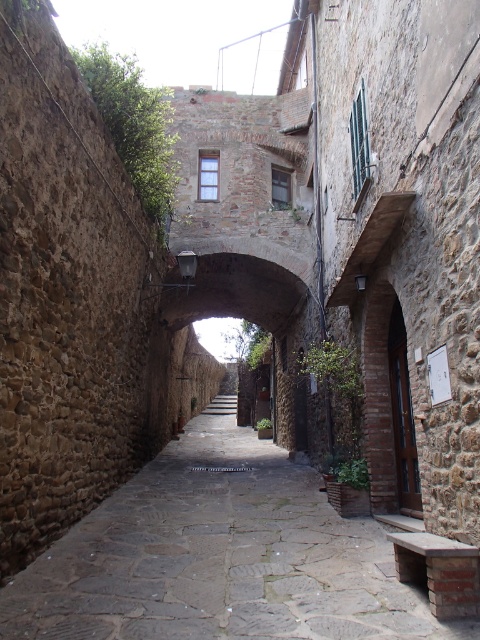
Is stone paved alley at center thinner than stone archway at center?

No.

Which is behind, point (141, 616) or point (278, 273)?

The point (278, 273) is behind.

The height and width of the screenshot is (640, 480). Identify the location of stone paved alley at center. (219, 556).